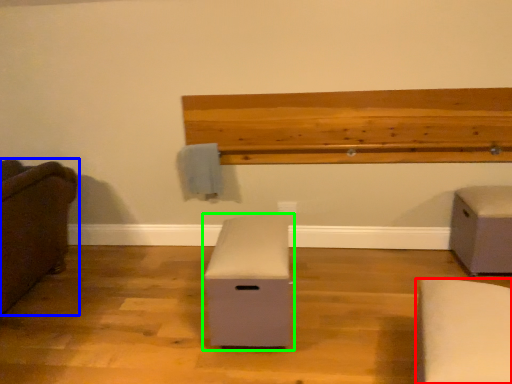
Question: Based on their relative distances, which object is nearer to furniture (highlighted by a red box)? Choose from furniture (highlighted by a blue box) and furniture (highlighted by a green box).

Choices:
 (A) furniture
 (B) furniture

Answer: (B)